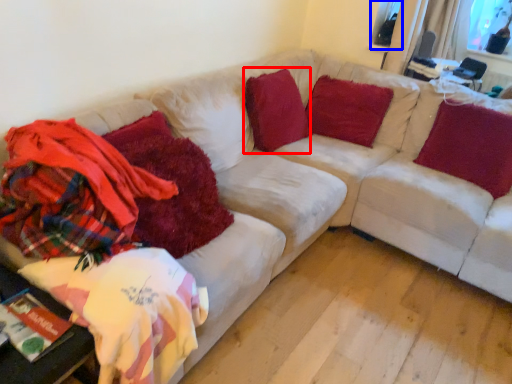
Question: Which object appears closest to the camera in this image, pillow (highlighted by a red box) or window screen (highlighted by a blue box)?

Choices:
 (A) pillow
 (B) window screen

Answer: (A)